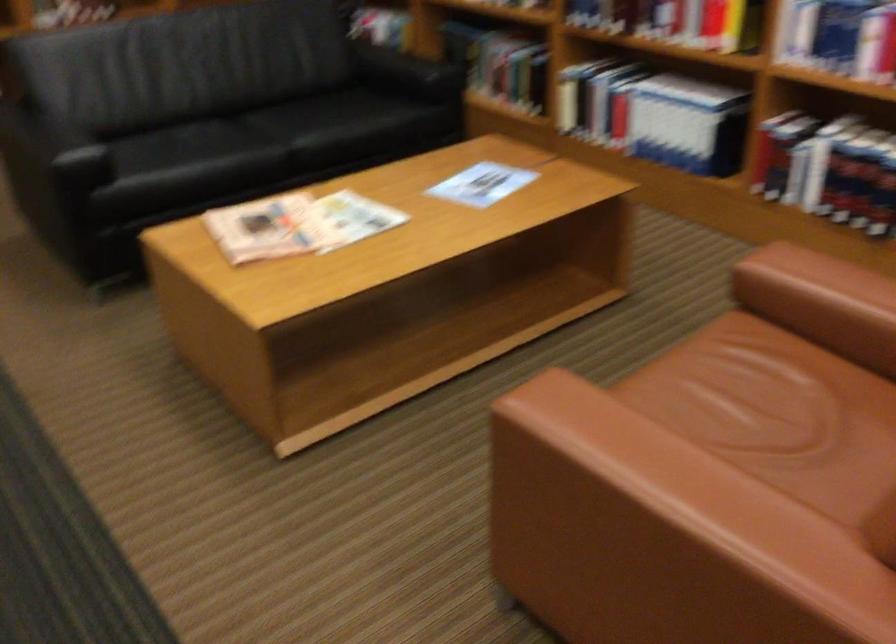
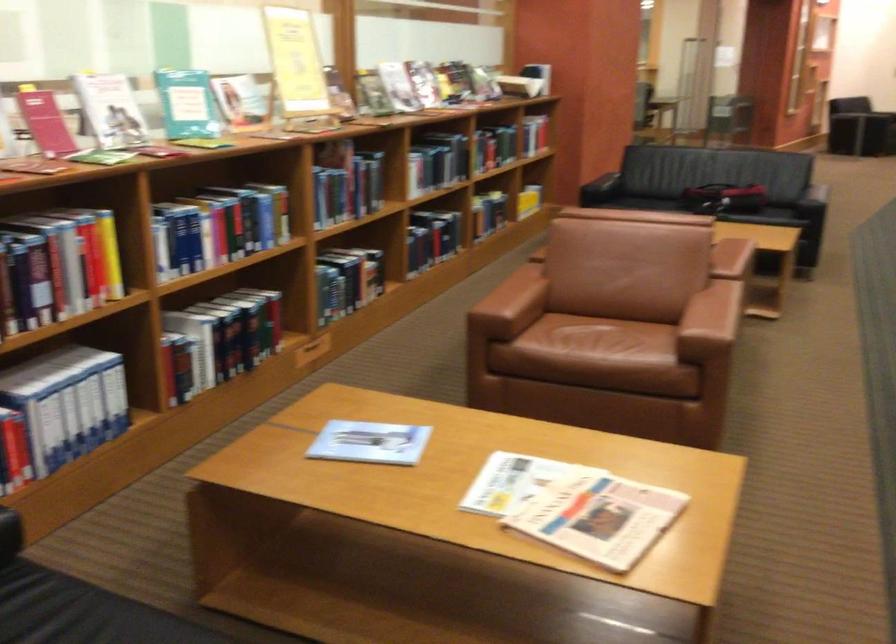
Locate, in the second image, the point that corresponds to [768,283] in the first image.

(510, 305)